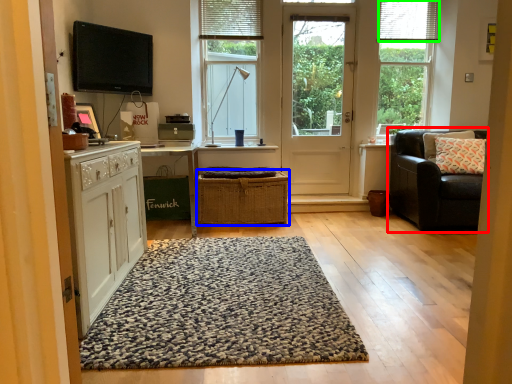
Question: Considering the real-world distances, which object is farthest from chair (highlighted by a red box)? crate (highlighted by a blue box) or blind (highlighted by a green box)?

Choices:
 (A) crate
 (B) blind

Answer: (B)